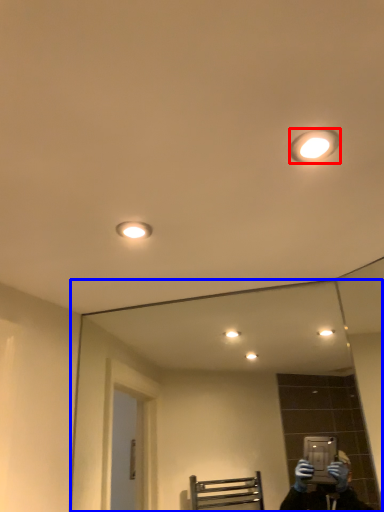
Question: Which of the following is the closest to the observer, light fixture (highlighted by a red box) or mirror (highlighted by a blue box)?

Choices:
 (A) light fixture
 (B) mirror

Answer: (A)